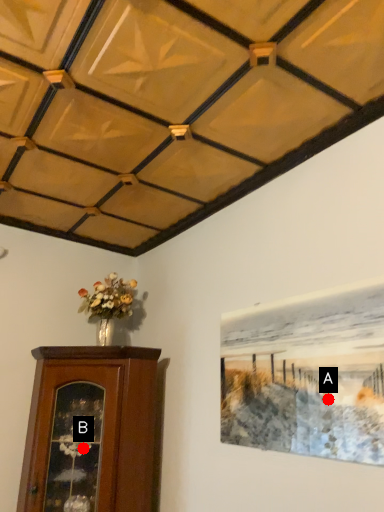
Question: Two points are circled on the image, labeled by A and B beside each circle. Which point is farther from the camera taking this photo?

Choices:
 (A) A is further
 (B) B is further

Answer: (B)